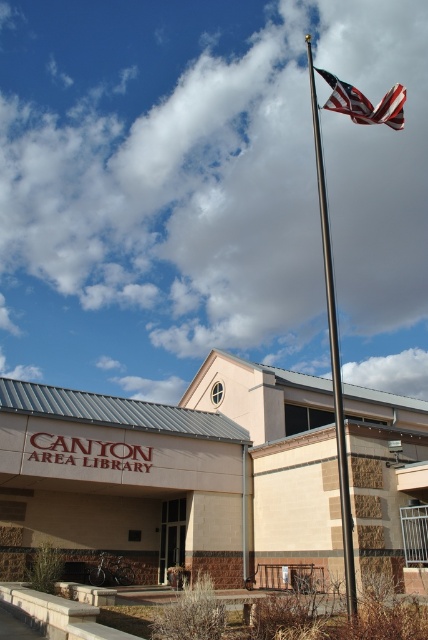
Question: Does polished metal flag pole at upper center come behind american flag at upper center?

Choices:
 (A) yes
 (B) no

Answer: (B)

Question: Is polished metal flag pole at upper center above american flag at upper center?

Choices:
 (A) no
 (B) yes

Answer: (A)

Question: Does polished metal flag pole at upper center have a smaller size compared to american flag at upper center?

Choices:
 (A) yes
 (B) no

Answer: (A)

Question: Which point is closer to the camera?

Choices:
 (A) american flag at upper center
 (B) polished metal flag pole at upper center

Answer: (B)

Question: Which point is closer to the camera taking this photo?

Choices:
 (A) (329, 259)
 (B) (386, 115)

Answer: (B)